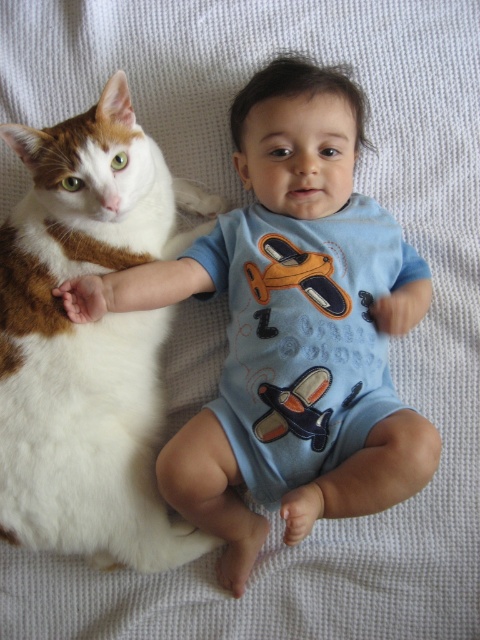
Question: Which of these objects is positioned closest to the white fluffy cat at left?

Choices:
 (A) blue cotton onesie at center
 (B) white fur paw at left

Answer: (A)

Question: Which of these objects is positioned farthest from the blue cotton onesie at center?

Choices:
 (A) white fur paw at left
 (B) white fluffy cat at left

Answer: (A)

Question: Is blue cotton onesie at center further to camera compared to white fluffy cat at left?

Choices:
 (A) no
 (B) yes

Answer: (B)

Question: Among these objects, which one is nearest to the camera?

Choices:
 (A) blue cotton onesie at center
 (B) white fur paw at left
 (C) white fluffy cat at left

Answer: (C)

Question: Is blue cotton onesie at center to the left of white fur paw at left from the viewer's perspective?

Choices:
 (A) no
 (B) yes

Answer: (A)

Question: Is white fluffy cat at left to the right of white fur paw at left from the viewer's perspective?

Choices:
 (A) no
 (B) yes

Answer: (B)